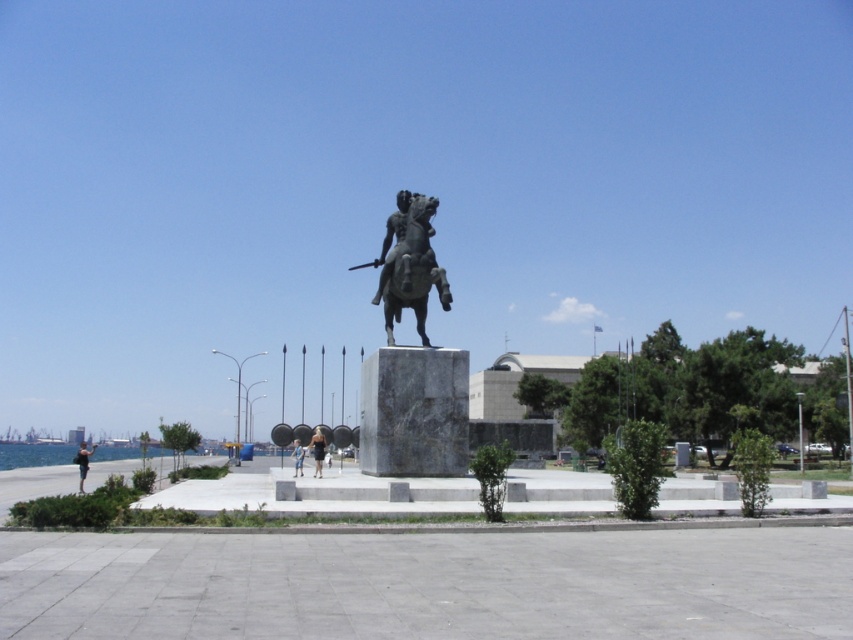
You are a photographer trying to capture both the dark blue dress at center and the blue denim shorts at center in a single frame. Given that your camera has a maximum focus range of 3 meters, will you be able to include both subjects in the shot?

The distance between the dark blue dress at center and the blue denim shorts at center is 3.40 meters. Since the camera can only focus up to 3 meters, the subjects are slightly out of the focus range, so they cannot both be in focus in a single frame.

You are a photographer planning to take a photo of the statue. You notice a person wearing a dark blue dress at center and another wearing light blue denim shorts at lower left. To ensure both are in frame, where should you position the camera relative to the statue?

Position the camera to the left of the statue so that the dark blue dress at center to the right of light blue denim shorts at lower left can both be captured in the frame.